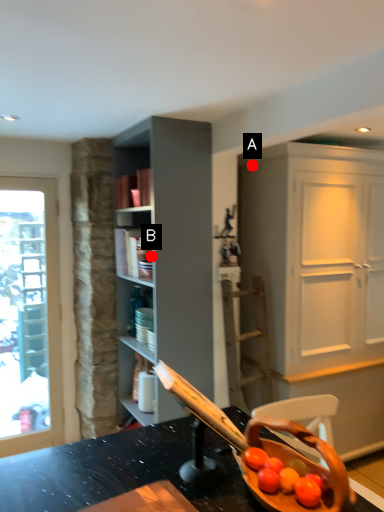
Question: Two points are circled on the image, labeled by A and B beside each circle. Which point is closer to the camera taking this photo?

Choices:
 (A) A is closer
 (B) B is closer

Answer: (B)